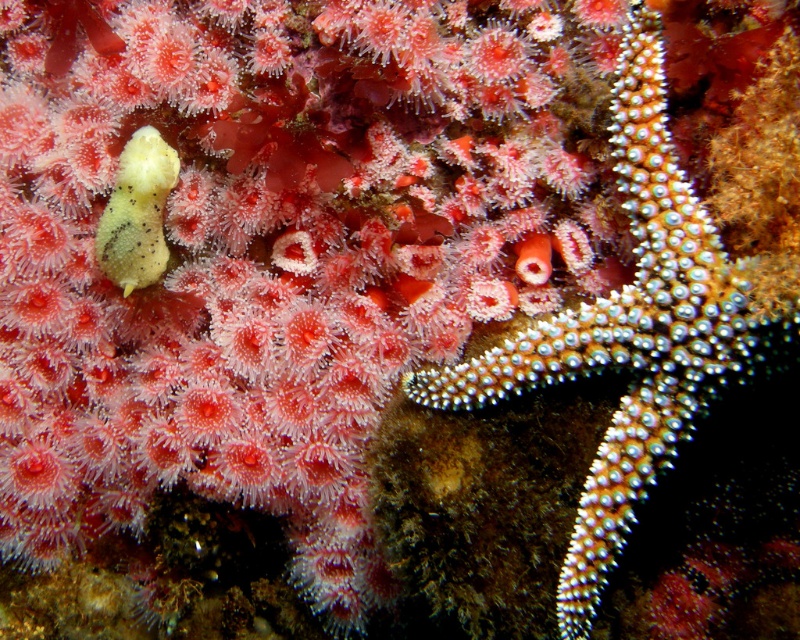
Question: Which point is farther to the camera?

Choices:
 (A) (138, 156)
 (B) (518, 364)

Answer: (A)

Question: Does white spiny starfish at center appear over matte yellow sponge at left?

Choices:
 (A) no
 (B) yes

Answer: (A)

Question: Which point is closer to the camera?

Choices:
 (A) (432, 396)
 (B) (120, 221)

Answer: (A)

Question: Does white spiny starfish at center have a lesser width compared to matte yellow sponge at left?

Choices:
 (A) no
 (B) yes

Answer: (A)

Question: Can you confirm if white spiny starfish at center is positioned to the left of matte yellow sponge at left?

Choices:
 (A) yes
 (B) no

Answer: (B)

Question: Which point is closer to the camera?

Choices:
 (A) white spiny starfish at center
 (B) matte yellow sponge at left

Answer: (A)